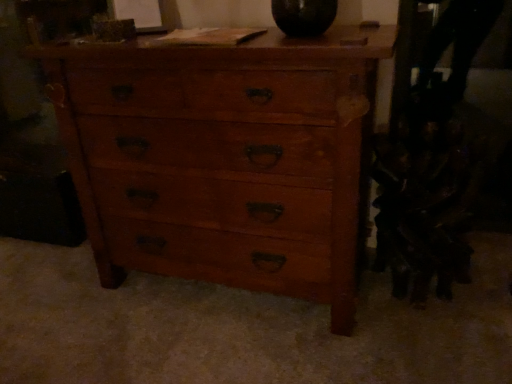
Question: Considering the relative positions of dark brown leather swivel chair at right and wooden chest of drawers at center in the image provided, is dark brown leather swivel chair at right to the left or to the right of wooden chest of drawers at center?

Choices:
 (A) left
 (B) right

Answer: (B)

Question: Does point (429, 238) appear closer or farther from the camera than point (252, 246)?

Choices:
 (A) farther
 (B) closer

Answer: (A)

Question: Is dark brown leather swivel chair at right in front of or behind wooden chest of drawers at center in the image?

Choices:
 (A) behind
 (B) front

Answer: (A)

Question: Is wooden chest of drawers at center in front of or behind dark brown leather swivel chair at right in the image?

Choices:
 (A) front
 (B) behind

Answer: (A)

Question: From a real-world perspective, is wooden chest of drawers at center above or below dark brown leather swivel chair at right?

Choices:
 (A) above
 (B) below

Answer: (A)

Question: Considering the positions of point (108, 115) and point (431, 41), is point (108, 115) closer or farther from the camera than point (431, 41)?

Choices:
 (A) closer
 (B) farther

Answer: (A)

Question: Choose the correct answer: Is wooden chest of drawers at center inside dark brown leather swivel chair at right or outside it?

Choices:
 (A) inside
 (B) outside

Answer: (B)